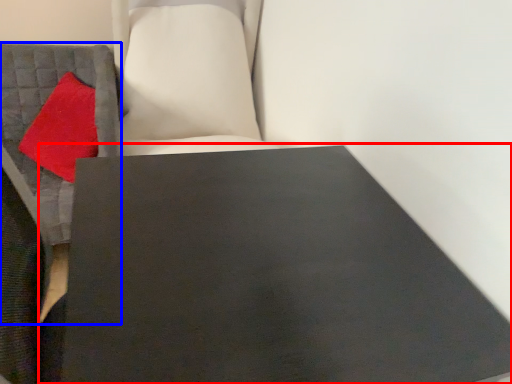
Question: Which point is further to the camera, table (highlighted by a red box) or furniture (highlighted by a blue box)?

Choices:
 (A) table
 (B) furniture

Answer: (B)